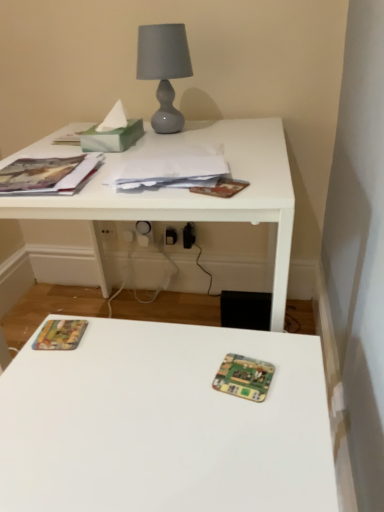
Locate an element on the screen. The width and height of the screenshot is (384, 512). vacant space situated above white paper at center (from a real-world perspective) is located at coordinates (175, 166).